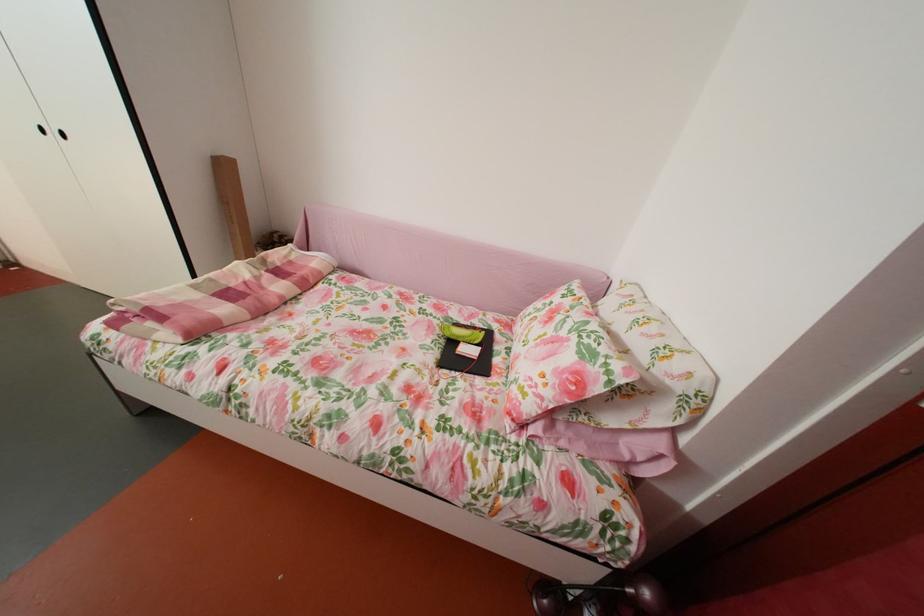
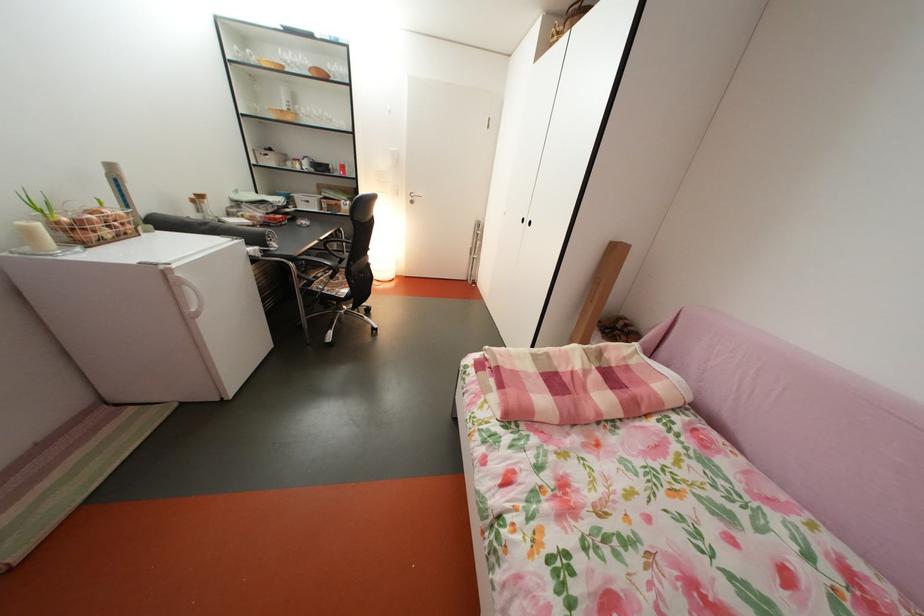
Question: The camera is either moving clockwise (left) or counter-clockwise (right) around the object. The first image is from the beginning of the video and the second image is from the end. Is the camera moving left or right when shooting the video?

Choices:
 (A) Left
 (B) Right

Answer: (B)